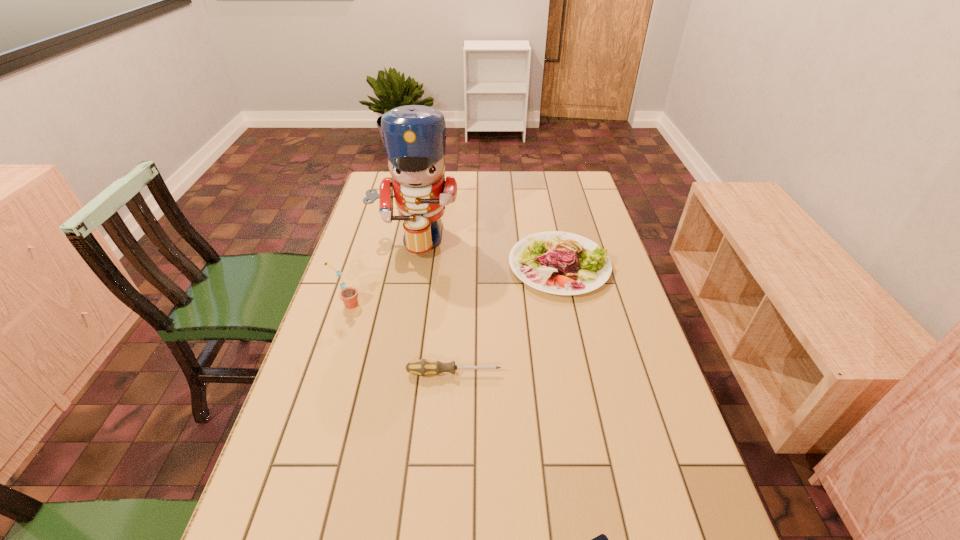
Find the location of `free space between the fourth tallest object and the tallest object`. free space between the fourth tallest object and the tallest object is located at coordinates (434, 306).

Identify the location of free spot between the tallest object and the second nearest object. (434, 306).

You are a GUI agent. You are given a task and a screenshot of the screen. Output one action in this format:
    pyautogui.click(x=<x>, y=<y>)
    Task: Click on the free area in between the fourth shortest object and the salad plate
    The width and height of the screenshot is (960, 540).
    Given the screenshot: What is the action you would take?
    pyautogui.click(x=453, y=285)

Image resolution: width=960 pixels, height=540 pixels. I want to click on blank region between the second nearest object and the third tallest object, so click(507, 319).

Find the location of a particular element. The height and width of the screenshot is (540, 960). the third closest object to the third tallest object is located at coordinates (348, 295).

Locate an element on the screen. The height and width of the screenshot is (540, 960). object that is the closest to the third shortest object is located at coordinates (414, 136).

Identify the location of free location that satisfies the following two spatial constraints: 1. on the front-facing side of the nutcracker; 2. on the flower of the second tallest object. (401, 305).

Identify the location of vacant space that satisfies the following two spatial constraints: 1. on the front-facing side of the tallest object; 2. on the flower of the sunflower. Image resolution: width=960 pixels, height=540 pixels. (401, 305).

Locate an element on the screen. This screenshot has height=540, width=960. vacant position in the image that satisfies the following two spatial constraints: 1. on the front-facing side of the tallest object; 2. on the left side of the third shortest object is located at coordinates (409, 265).

You are a GUI agent. You are given a task and a screenshot of the screen. Output one action in this format:
    pyautogui.click(x=<x>, y=<y>)
    Task: Click on the free space in the image that satisfies the following two spatial constraints: 1. on the front side of the salad plate; 2. at the tip of the second nearest object
    
    Given the screenshot: What is the action you would take?
    pyautogui.click(x=582, y=373)